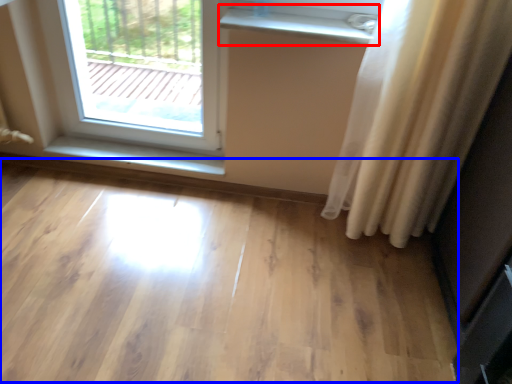
Question: Which point is closer to the camera, window sill (highlighted by a red box) or plain (highlighted by a blue box)?

Choices:
 (A) window sill
 (B) plain

Answer: (B)